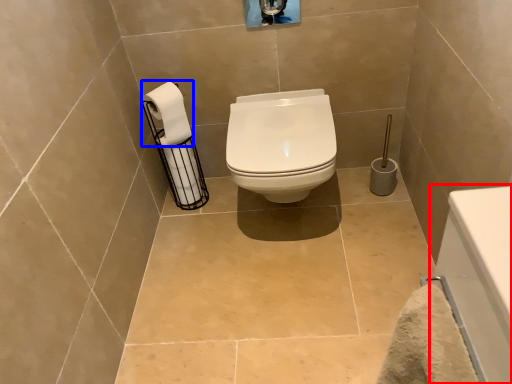
Question: Which point is further to the camera, bath (highlighted by a red box) or toilet paper (highlighted by a blue box)?

Choices:
 (A) bath
 (B) toilet paper

Answer: (B)